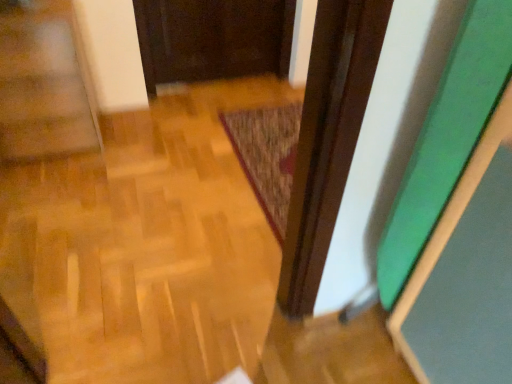
Question: Is textured brown mat at center situated inside wooden parquet floor at lower left or outside?

Choices:
 (A) outside
 (B) inside

Answer: (A)

Question: Is textured brown mat at center to the left or to the right of wooden parquet floor at lower left in the image?

Choices:
 (A) left
 (B) right

Answer: (B)

Question: Looking at the image, does textured brown mat at center seem bigger or smaller compared to wooden parquet floor at lower left?

Choices:
 (A) big
 (B) small

Answer: (B)

Question: Is wooden parquet floor at lower left bigger or smaller than textured brown mat at center?

Choices:
 (A) small
 (B) big

Answer: (B)

Question: From a real-world perspective, is wooden parquet floor at lower left physically located above or below textured brown mat at center?

Choices:
 (A) below
 (B) above

Answer: (B)

Question: Considering the positions of wooden parquet floor at lower left and textured brown mat at center in the image, is wooden parquet floor at lower left taller or shorter than textured brown mat at center?

Choices:
 (A) short
 (B) tall

Answer: (B)

Question: Relative to textured brown mat at center, is wooden parquet floor at lower left in front or behind?

Choices:
 (A) behind
 (B) front

Answer: (B)